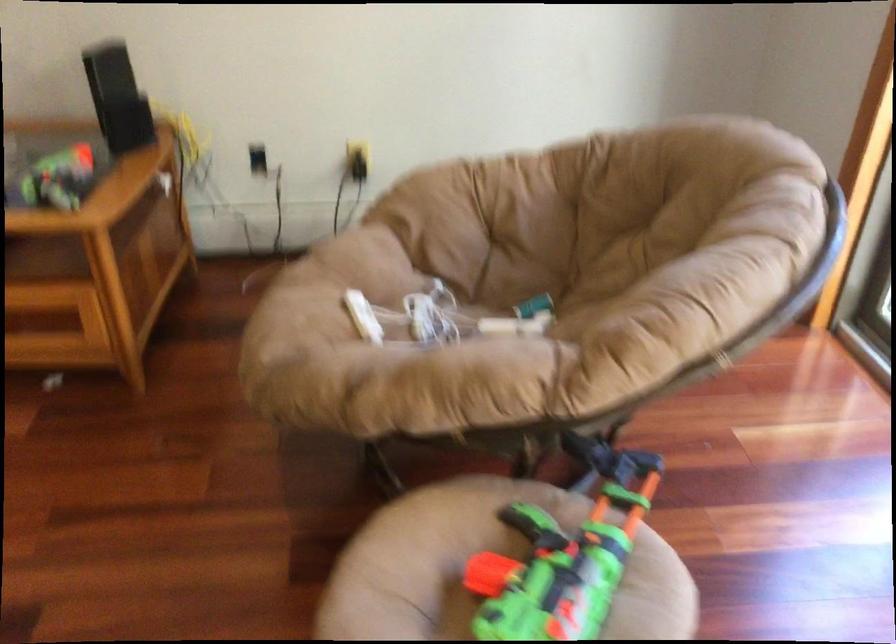
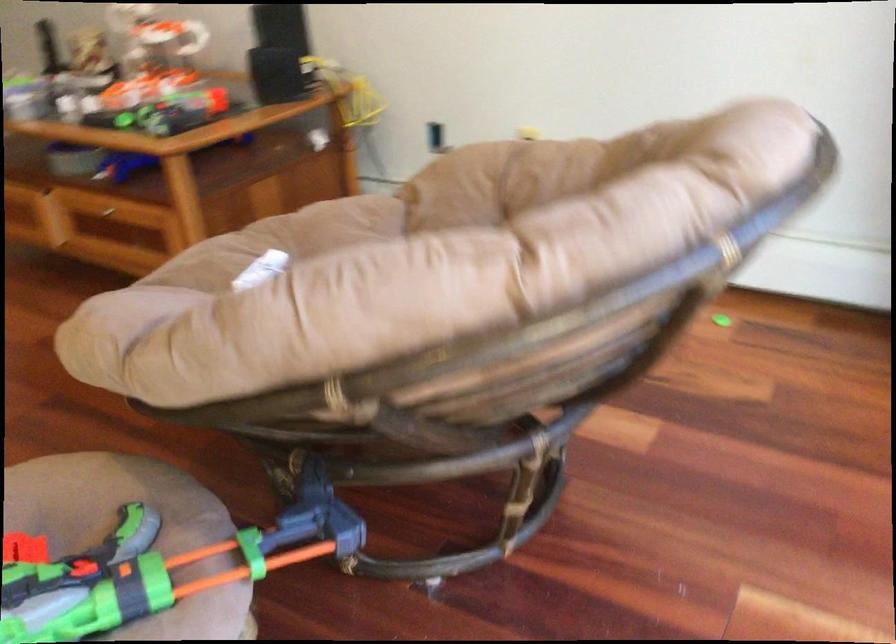
Question: I am providing you with two images of the same scene from different viewpoints. Please identify which objects are invisible in image2.

Choices:
 (A) drawer handle
 (B) chair sitting surface
 (C) toy gun handle
 (D) orange control screen

Answer: (B)